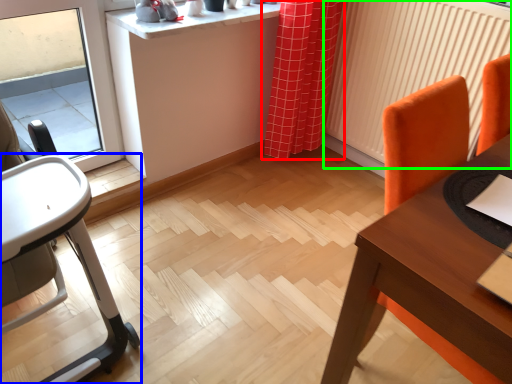
Question: Considering the real-world distances, which object is farthest from curtain (highlighted by a red box)? chair (highlighted by a blue box) or radiator (highlighted by a green box)?

Choices:
 (A) chair
 (B) radiator

Answer: (A)